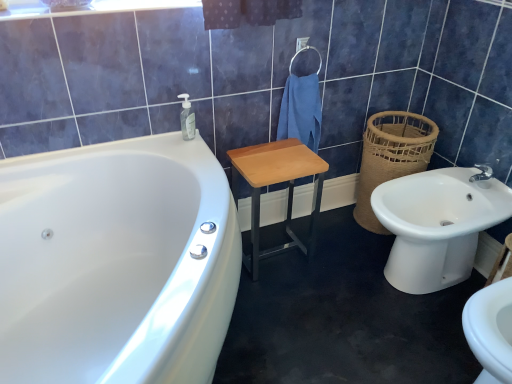
Describe the element at coordinates (438, 224) in the screenshot. I see `white ceramic sink at right` at that location.

What do you see at coordinates (391, 157) in the screenshot? The width and height of the screenshot is (512, 384). I see `brown woven basket at right` at bounding box center [391, 157].

This screenshot has width=512, height=384. What are the coordinates of `brown woven basket at right` in the screenshot? It's located at (391, 157).

Image resolution: width=512 pixels, height=384 pixels. Find the location of `white ceramic sink at right`. white ceramic sink at right is located at coordinates (438, 224).

Is wooden/matte step stool at center far from brown woven basket at right?

They are positioned close to each other.

Which is nearer, (310, 230) or (390, 125)?

Point (310, 230) is farther from the camera than point (390, 125).

Considering the relative positions of wooden/matte step stool at center and brown woven basket at right in the image provided, is wooden/matte step stool at center to the left or to the right of brown woven basket at right?

Clearly, wooden/matte step stool at center is on the left of brown woven basket at right in the image.

From the image's perspective, is wooden/matte step stool at center located above brown woven basket at right?

No, from the image's perspective, wooden/matte step stool at center is not on top of brown woven basket at right.

Measure the distance from translucent plastic soap dispenser at upper left to white ceramic sink at right.

3.39 feet.

Locate an element on the screen. This screenshot has height=384, width=512. sink in front of the translucent plastic soap dispenser at upper left is located at coordinates [438, 224].

Looking at this image, from a real-world perspective, between translucent plastic soap dispenser at upper left and white ceramic sink at right, who is vertically higher?

translucent plastic soap dispenser at upper left is physically above.

Considering the sizes of objects translucent plastic soap dispenser at upper left and white ceramic sink at right in the image provided, who is smaller, translucent plastic soap dispenser at upper left or white ceramic sink at right?

translucent plastic soap dispenser at upper left is smaller.

Based on their sizes in the image, would you say brown woven basket at right is bigger or smaller than white glossy bathtub at left?

Clearly, brown woven basket at right is smaller in size than white glossy bathtub at left.

Consider the image. From the image's perspective, between brown woven basket at right and white glossy bathtub at left, which one is located above?

From the image's view, brown woven basket at right is above.

Does brown woven basket at right have a greater height compared to white glossy bathtub at left?

Incorrect, the height of brown woven basket at right is not larger of that of white glossy bathtub at left.

From the image's perspective, which object appears higher, white glossy bathtub at left or wooden/matte step stool at center?

wooden/matte step stool at center.

Considering the relative sizes of white glossy bathtub at left and wooden/matte step stool at center in the image provided, is white glossy bathtub at left wider than wooden/matte step stool at center?

Indeed, white glossy bathtub at left has a greater width compared to wooden/matte step stool at center.

Is the surface of white glossy bathtub at left in direct contact with wooden/matte step stool at center?

No.

From a real-world perspective, who is located higher, white glossy bathtub at left or wooden/matte step stool at center?

white glossy bathtub at left is physically above.

Could you tell me if wooden/matte step stool at center is turned towards blue cotton towel at center?

No.

Which point is more distant from viewer, (302, 144) or (310, 133)?

Positioned behind is point (310, 133).

Does wooden/matte step stool at center have a lesser height compared to blue cotton towel at center?

In fact, wooden/matte step stool at center may be taller than blue cotton towel at center.

Which object is thinner, wooden/matte step stool at center or blue cotton towel at center?

blue cotton towel at center is thinner.

Looking at the image, does wooden/matte step stool at center seem bigger or smaller compared to white ceramic sink at right?

Considering their sizes, wooden/matte step stool at center takes up less space than white ceramic sink at right.

How many degrees apart are the facing directions of wooden/matte step stool at center and white ceramic sink at right?

There is a 93.3-degree angle between the facing directions of wooden/matte step stool at center and white ceramic sink at right.

From the image's perspective, which object appears higher, wooden/matte step stool at center or white ceramic sink at right?

wooden/matte step stool at center appears higher in the image.

From a real-world perspective, who is located higher, wooden/matte step stool at center or white ceramic sink at right?

wooden/matte step stool at center.

Is blue cotton towel at center far from translucent plastic soap dispenser at upper left?

blue cotton towel at center is actually quite close to translucent plastic soap dispenser at upper left.

Is blue cotton towel at center situated inside translucent plastic soap dispenser at upper left or outside?

blue cotton towel at center cannot be found inside translucent plastic soap dispenser at upper left.

From a real-world perspective, is blue cotton towel at center located beneath translucent plastic soap dispenser at upper left?

Yes, from a real-world perspective, blue cotton towel at center is under translucent plastic soap dispenser at upper left.

Find the location of `basket behind the wooden/matte step stool at center`. basket behind the wooden/matte step stool at center is located at coordinates (391, 157).

This screenshot has width=512, height=384. I want to click on soap dispenser located above the white ceramic sink at right (from a real-world perspective), so click(x=187, y=118).

Estimate the real-world distances between objects in this image. Which object is closer to wooden/matte step stool at center, white glossy bathtub at left or brown woven basket at right?

Based on the image, brown woven basket at right appears to be nearer to wooden/matte step stool at center.

Based on their spatial positions, is wooden/matte step stool at center or blue cotton towel at center closer to brown woven basket at right?

Among the two, blue cotton towel at center is located nearer to brown woven basket at right.

Which object lies nearer to the anchor point wooden/matte step stool at center, white glossy bathtub at left or translucent plastic soap dispenser at upper left?

translucent plastic soap dispenser at upper left is positioned closer to the anchor wooden/matte step stool at center.

Estimate the real-world distances between objects in this image. Which object is closer to wooden/matte step stool at center, brown woven basket at right or translucent plastic soap dispenser at upper left?

The object closer to wooden/matte step stool at center is brown woven basket at right.

Looking at the image, which one is located further to blue cotton towel at center, translucent plastic soap dispenser at upper left or brown woven basket at right?

translucent plastic soap dispenser at upper left is further to blue cotton towel at center.

From the image, which object appears to be farther from brown woven basket at right, translucent plastic soap dispenser at upper left or white glossy bathtub at left?

Among the two, white glossy bathtub at left is located further to brown woven basket at right.

Looking at the image, which one is located further to wooden/matte step stool at center, white ceramic sink at right or brown woven basket at right?

Among the two, white ceramic sink at right is located further to wooden/matte step stool at center.

Estimate the real-world distances between objects in this image. Which object is closer to wooden/matte step stool at center, translucent plastic soap dispenser at upper left or white glossy bathtub at left?

translucent plastic soap dispenser at upper left is closer to wooden/matte step stool at center.

Where is `soap dispenser between white glossy bathtub at left and white ceramic sink at right from left to right`? Image resolution: width=512 pixels, height=384 pixels. soap dispenser between white glossy bathtub at left and white ceramic sink at right from left to right is located at coordinates (x=187, y=118).

The height and width of the screenshot is (384, 512). I want to click on soap dispenser between white glossy bathtub at left and brown woven basket at right from front to back, so click(187, 118).

Identify the location of step stool between white glossy bathtub at left and blue cotton towel at center in the front-back direction. (275, 183).

Image resolution: width=512 pixels, height=384 pixels. In order to click on basket between translucent plastic soap dispenser at upper left and white ceramic sink at right in the horizontal direction in this screenshot , I will do `click(391, 157)`.